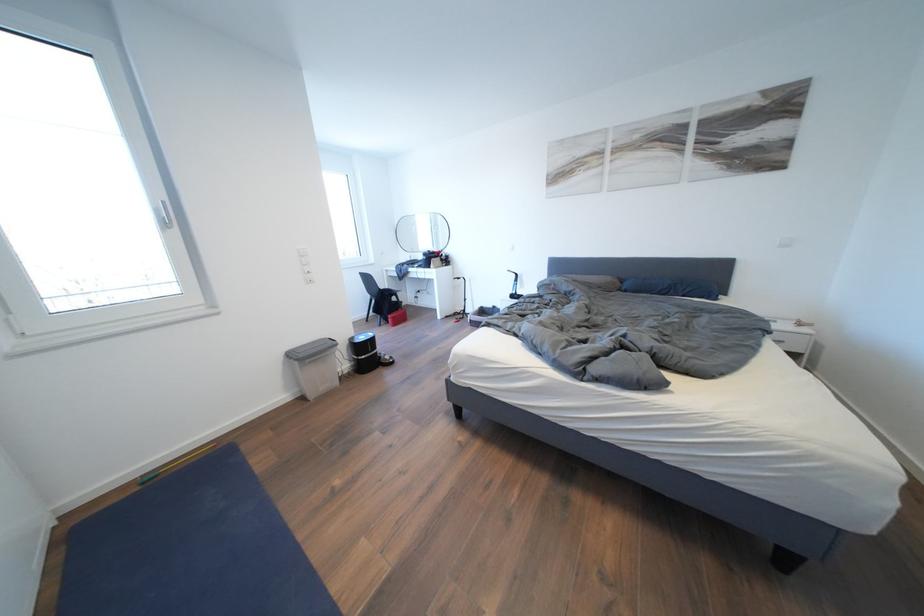
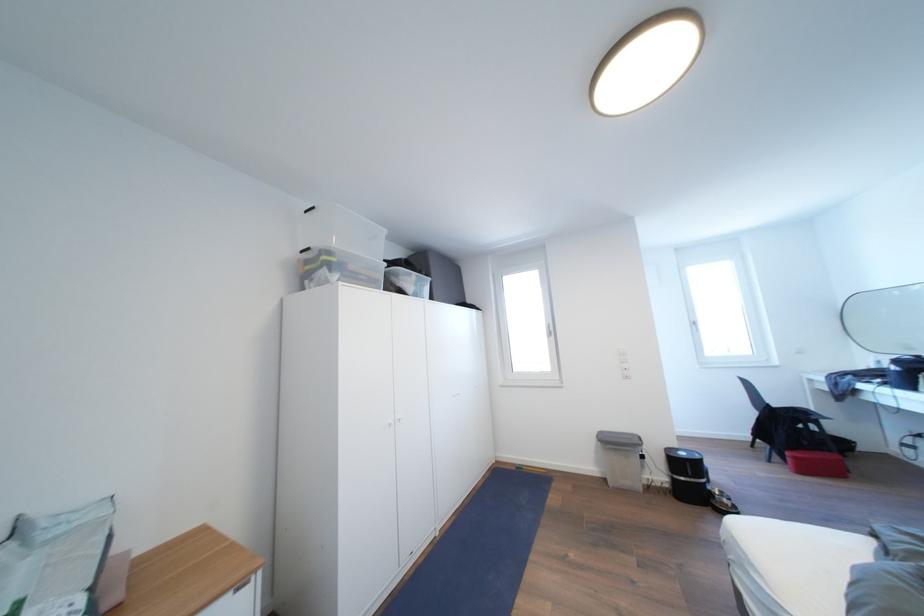
Locate, in the second image, the point that corresponds to point (370, 342) in the first image.

(689, 459)